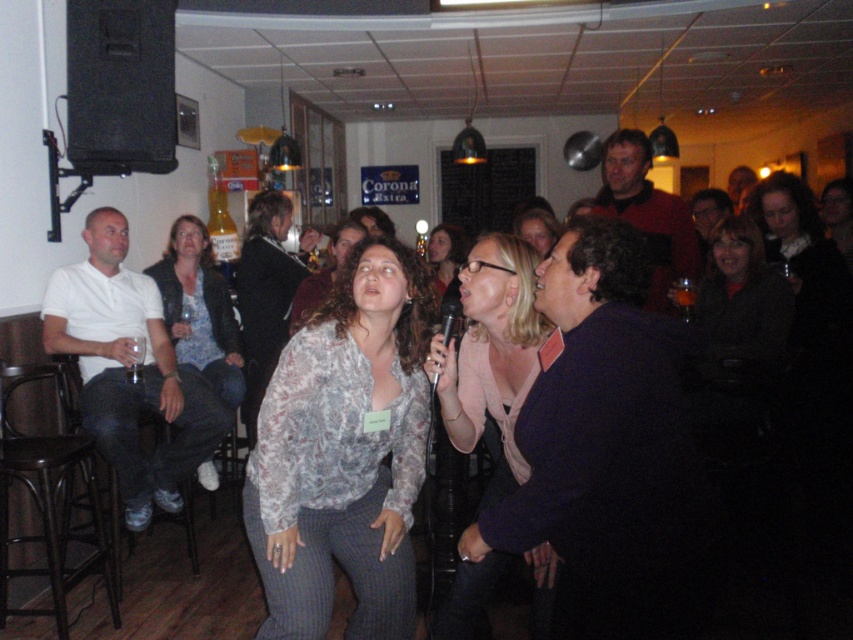
Is patterned fabric blouse at center wider than matte black jacket at center?

Indeed, patterned fabric blouse at center has a greater width compared to matte black jacket at center.

Is point (247, 509) farther from camera compared to point (704, 298)?

No, (247, 509) is closer to viewer.

Where is `patterned fabric blouse at center`? patterned fabric blouse at center is located at coordinates (344, 452).

Looking at this image, is patterned fabric blouse at center to the left of light brown leather jacket at center from the viewer's perspective?

Incorrect, patterned fabric blouse at center is not on the left side of light brown leather jacket at center.

How far apart are patterned fabric blouse at center and light brown leather jacket at center?

They are 54.83 centimeters apart.

Does point (321, 476) lie in front of point (346, 246)?

That is True.

Image resolution: width=853 pixels, height=640 pixels. Identify the location of patterned fabric blouse at center. (344, 452).

Does dark blue sweater at center have a greater width compared to black plastic microphone at center?

Correct, the width of dark blue sweater at center exceeds that of black plastic microphone at center.

Can you confirm if dark blue sweater at center is smaller than black plastic microphone at center?

No.

Who is more distant from viewer, (566, 369) or (445, 294)?

The point (445, 294) is behind.

Find the location of a particular element. The width and height of the screenshot is (853, 640). dark blue sweater at center is located at coordinates point(606,451).